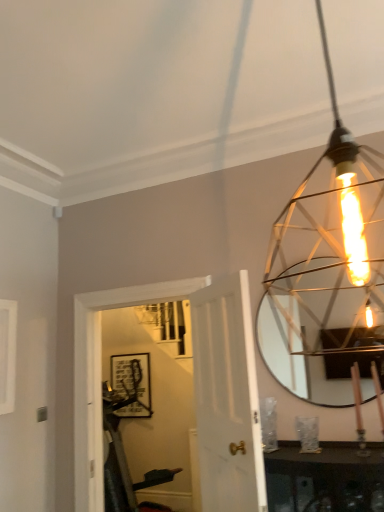
Question: Is matte gold wire cage at upper right thinner than white wood door at center?

Choices:
 (A) yes
 (B) no

Answer: (B)

Question: From a real-world perspective, is matte gold wire cage at upper right located higher than white wood door at center?

Choices:
 (A) no
 (B) yes

Answer: (B)

Question: Considering the relative sizes of matte gold wire cage at upper right and white wood door at center in the image provided, is matte gold wire cage at upper right smaller than white wood door at center?

Choices:
 (A) no
 (B) yes

Answer: (B)

Question: Can you confirm if matte gold wire cage at upper right is wider than white wood door at center?

Choices:
 (A) no
 (B) yes

Answer: (B)

Question: From the image's perspective, does matte gold wire cage at upper right appear lower than white wood door at center?

Choices:
 (A) no
 (B) yes

Answer: (A)

Question: Considering the relative sizes of matte gold wire cage at upper right and white wood door at center in the image provided, is matte gold wire cage at upper right taller than white wood door at center?

Choices:
 (A) no
 (B) yes

Answer: (A)

Question: Can you confirm if matte gold wire cage at upper right is positioned to the left of matte black picture frame at center?

Choices:
 (A) no
 (B) yes

Answer: (A)

Question: Is matte gold wire cage at upper right wider than matte black picture frame at center?

Choices:
 (A) no
 (B) yes

Answer: (B)

Question: Is the position of matte gold wire cage at upper right more distant than that of matte black picture frame at center?

Choices:
 (A) no
 (B) yes

Answer: (A)

Question: From a real-world perspective, does matte gold wire cage at upper right sit lower than matte black picture frame at center?

Choices:
 (A) yes
 (B) no

Answer: (B)

Question: Considering the relative positions of matte gold wire cage at upper right and matte black picture frame at center in the image provided, is matte gold wire cage at upper right to the right of matte black picture frame at center from the viewer's perspective?

Choices:
 (A) yes
 (B) no

Answer: (A)

Question: Can you confirm if matte gold wire cage at upper right is shorter than matte black picture frame at center?

Choices:
 (A) no
 (B) yes

Answer: (A)

Question: Considering the relative sizes of matte black picture frame at center and matte gold wire cage at upper right in the image provided, is matte black picture frame at center smaller than matte gold wire cage at upper right?

Choices:
 (A) yes
 (B) no

Answer: (A)